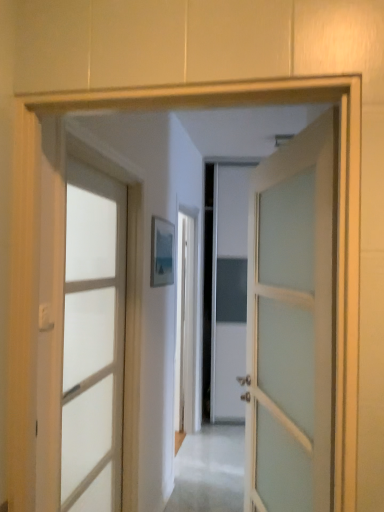
Question: Could you tell me if clear glass door at left, the 1th door positioned from the left, is facing satin white door at center, which appears as the second door when viewed from the left?

Choices:
 (A) yes
 (B) no

Answer: (A)

Question: From the image's perspective, is clear glass door at left, the 1th door positioned from the left, above satin white door at center, which appears as the second door when viewed from the left?

Choices:
 (A) no
 (B) yes

Answer: (A)

Question: Can you confirm if clear glass door at left, the 1th door positioned from the left, is bigger than satin white door at center, the 1th door when ordered from right to left?

Choices:
 (A) yes
 (B) no

Answer: (B)

Question: From a real-world perspective, is clear glass door at left, placed as the second door when sorted from right to left, positioned under satin white door at center, the 1th door when ordered from right to left, based on gravity?

Choices:
 (A) no
 (B) yes

Answer: (B)

Question: Does clear glass door at left, placed as the second door when sorted from right to left, have a smaller size compared to satin white door at center, which appears as the second door when viewed from the left?

Choices:
 (A) yes
 (B) no

Answer: (A)

Question: Does clear glass door at left, the 1th door positioned from the left, have a greater height compared to satin white door at center, the 1th door when ordered from right to left?

Choices:
 (A) yes
 (B) no

Answer: (A)

Question: Can you confirm if satin white door at center, which appears as the second door when viewed from the left, is positioned to the right of clear glass door at left, placed as the second door when sorted from right to left?

Choices:
 (A) yes
 (B) no

Answer: (A)

Question: Can you confirm if satin white door at center, which appears as the second door when viewed from the left, is thinner than clear glass door at left, the 1th door positioned from the left?

Choices:
 (A) yes
 (B) no

Answer: (B)

Question: Is satin white door at center, which appears as the second door when viewed from the left, to the left of clear glass door at left, placed as the second door when sorted from right to left, from the viewer's perspective?

Choices:
 (A) yes
 (B) no

Answer: (B)

Question: Is satin white door at center, the 1th door when ordered from right to left, taller than clear glass door at left, placed as the second door when sorted from right to left?

Choices:
 (A) yes
 (B) no

Answer: (B)

Question: Is satin white door at center, which appears as the second door when viewed from the left, located outside clear glass door at left, placed as the second door when sorted from right to left?

Choices:
 (A) no
 (B) yes

Answer: (B)

Question: Is satin white door at center, the 1th door when ordered from right to left, positioned before clear glass door at left, the 1th door positioned from the left?

Choices:
 (A) yes
 (B) no

Answer: (A)

Question: Is clear glass door at left, placed as the second door when sorted from right to left, wider or thinner than satin white door at center, the 1th door when ordered from right to left?

Choices:
 (A) thin
 (B) wide

Answer: (A)